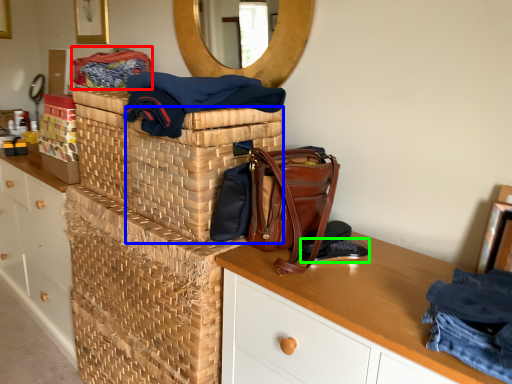
Question: Which object is the closest to the material (highlighted by a red box)? Choose among these: basket (highlighted by a blue box) or shoe (highlighted by a green box).

Choices:
 (A) basket
 (B) shoe

Answer: (A)